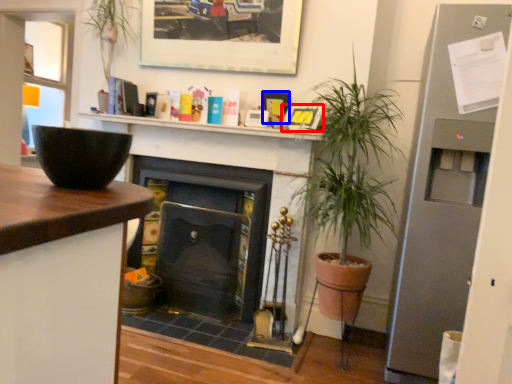
Question: Which object appears farthest to the camera in this image, picture frame (highlighted by a red box) or picture frame (highlighted by a blue box)?

Choices:
 (A) picture frame
 (B) picture frame

Answer: (B)